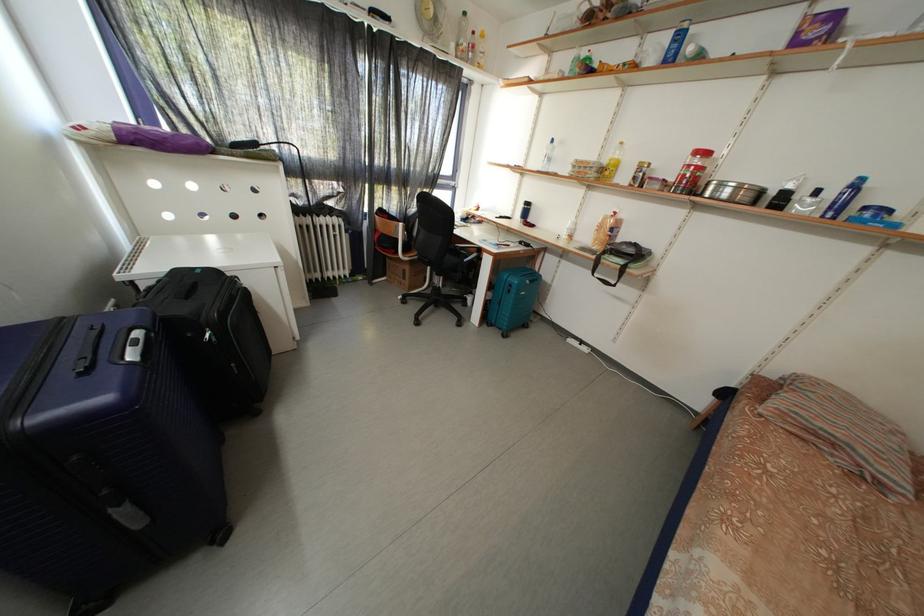
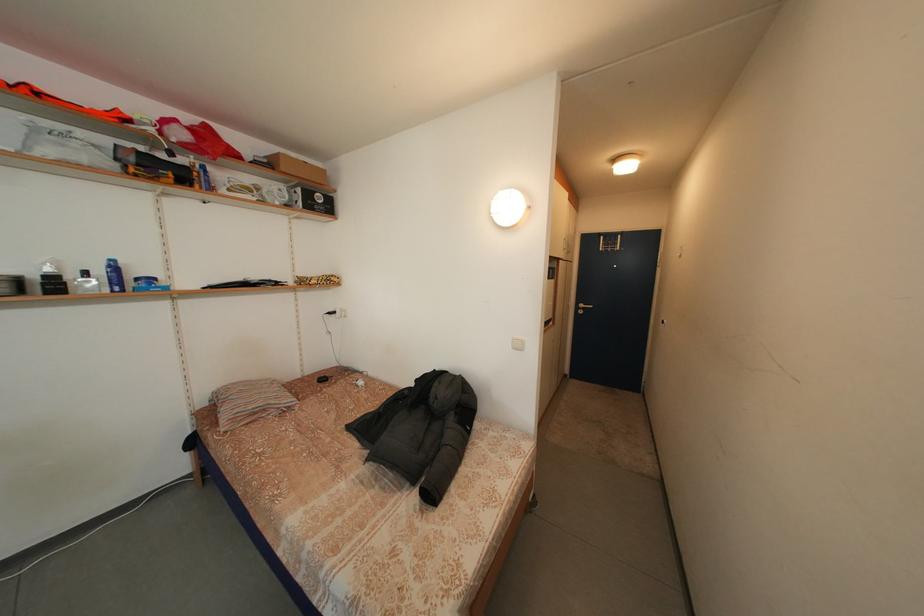
The point at (845, 212) is marked in the first image. Where is the corresponding point in the second image?

(125, 286)